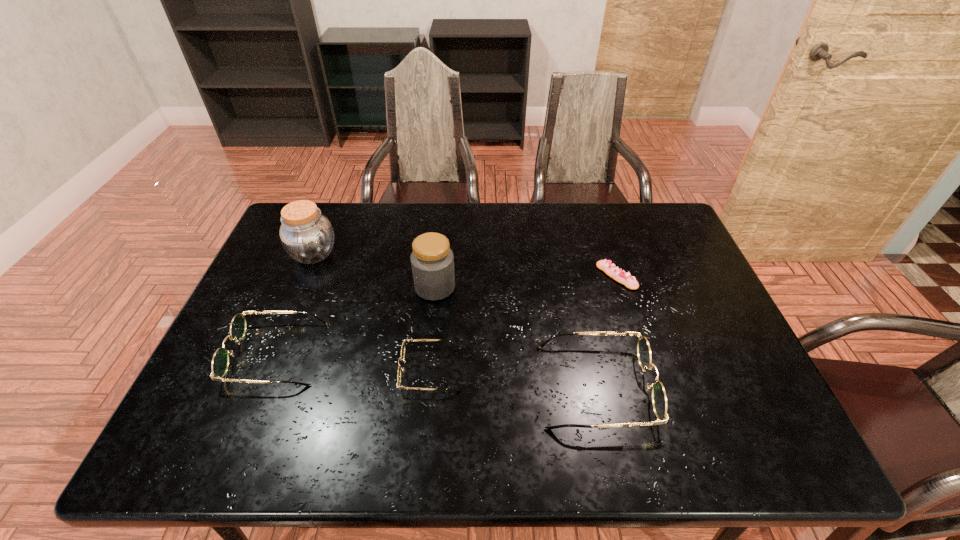
Considering the uniform spacing of spectacless, where should an additional spectacles be positioned on the right? Please locate a free spot. Please provide its 2D coordinates. Your answer should be formatted as a tuple, i.e. [(x, y)], where the tuple contains the x and y coordinates of a point satisfying the conditions above.

[(770, 404)]